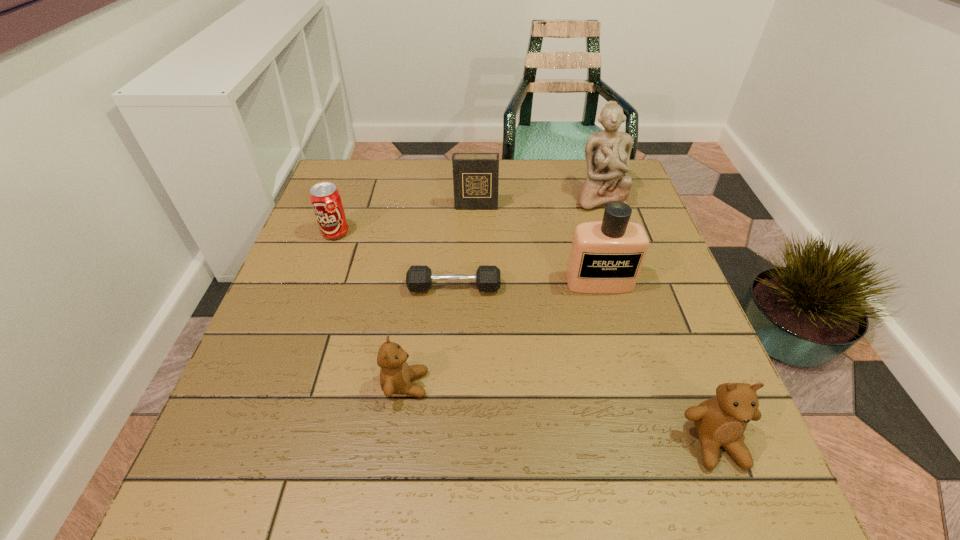
Identify the location of empty space that is in between the perfume and the diary. The height and width of the screenshot is (540, 960). (538, 244).

This screenshot has width=960, height=540. I want to click on free area in between the right teddy bear and the shortest object, so click(x=585, y=365).

This screenshot has width=960, height=540. I want to click on vacant area that lies between the figurine and the left teddy bear, so click(502, 291).

Identify the location of free spot between the diary and the leftmost object. The height and width of the screenshot is (540, 960). (406, 220).

Identify the location of empty space between the shortest object and the diary. Image resolution: width=960 pixels, height=540 pixels. (465, 247).

I want to click on free area in between the fifth nearest object and the shortest object, so click(x=395, y=260).

Find the location of a particular element. This screenshot has height=540, width=960. free spot between the diary and the figurine is located at coordinates (538, 202).

Locate an element on the screen. The width and height of the screenshot is (960, 540). the fourth closest object relative to the shortest object is located at coordinates (475, 175).

Identify which object is the fourth nearest to the tallest object. Please provide its 2D coordinates. Your answer should be formatted as a tuple, i.e. [(x, y)], where the tuple contains the x and y coordinates of a point satisfying the conditions above.

[(720, 421)]